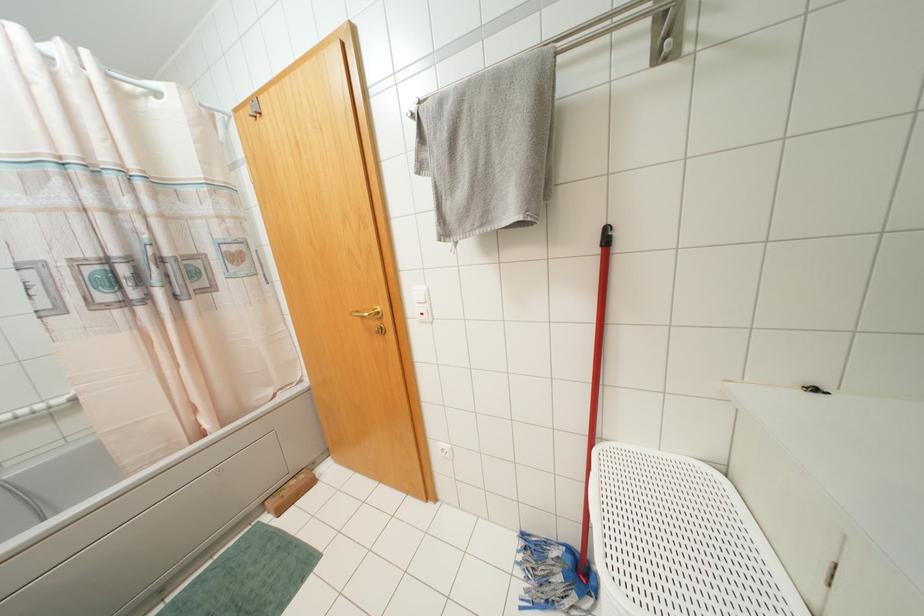
Locate an element on the screen. This screenshot has width=924, height=616. red mop handle is located at coordinates (594, 391).